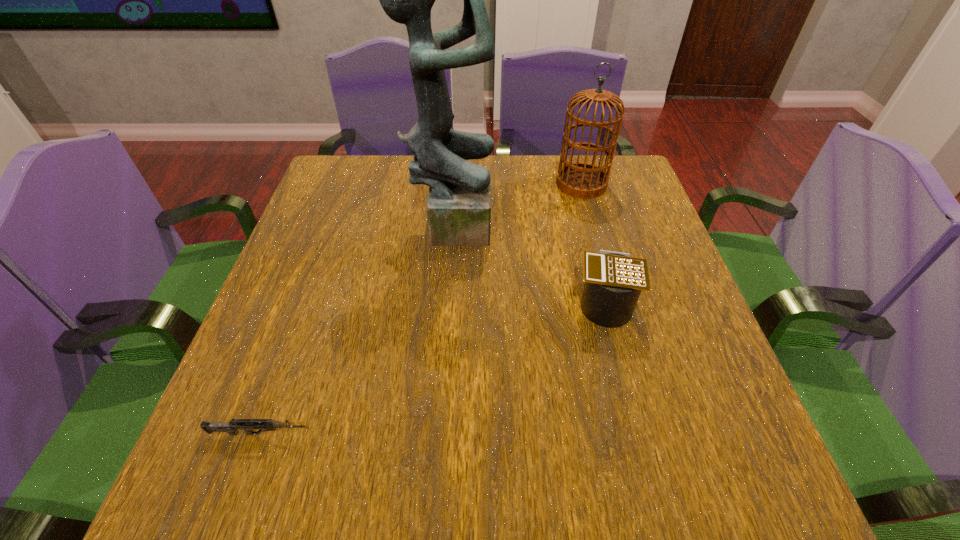
The image size is (960, 540). Identify the location of the tallest object. (459, 202).

I want to click on the third object from right to left, so click(x=459, y=202).

What are the coordinates of `the third shortest object` in the screenshot? It's located at (582, 180).

This screenshot has height=540, width=960. I want to click on the second shortest object, so click(x=613, y=281).

At what (x,y) coordinates should I click in order to perform the action: click on the third farthest object. Please return your answer as a coordinate pair (x, y). Looking at the image, I should click on (613, 281).

The image size is (960, 540). I want to click on gun, so click(x=231, y=427).

This screenshot has width=960, height=540. I want to click on the shortest object, so click(x=231, y=427).

Locate an element on the screen. Image resolution: width=960 pixels, height=540 pixels. vacant space located on the face of the second object from left to right is located at coordinates (568, 221).

Where is `free location located 0.050m on the right of the second tallest object`? free location located 0.050m on the right of the second tallest object is located at coordinates (625, 184).

What are the coordinates of `free spot located 0.080m on the front of the third tallest object` in the screenshot? It's located at (619, 362).